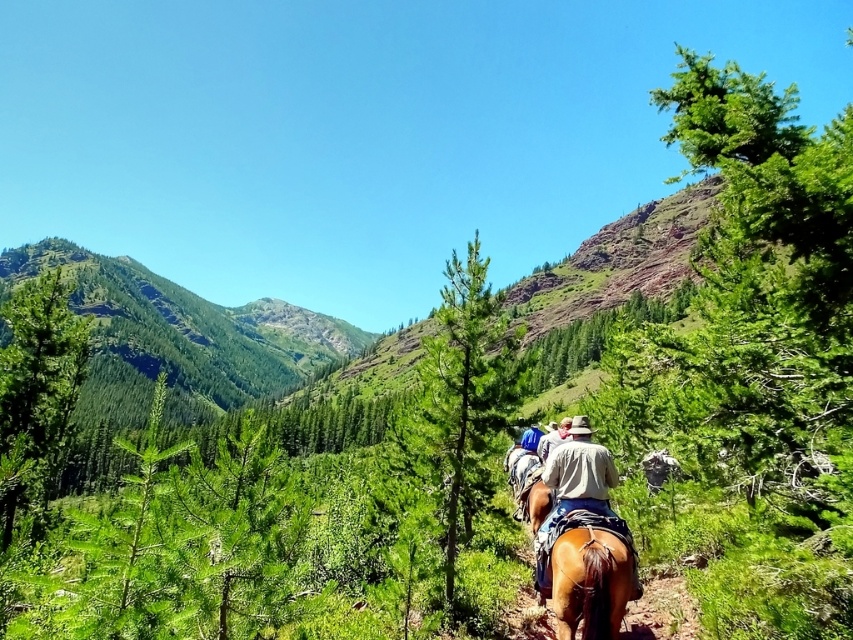
You are a photographer trying to capture a clear shot of the brown leather horse at center and the light brown leather jacket at center. Since you want the horse to be the main focus, which object should you position closer to the camera to ensure it appears larger in the photo?

The brown leather horse at center has a lesser height compared to the light brown leather jacket at center, so to make the horse appear larger in the photo, you should position the horse closer to the camera than the light brown leather jacket at center.

You are a photographer trying to capture a clear shot of the brown leather horse at center and the light brown leather jacket at center. Since you want both subjects to be in focus, which one should you focus on first, the wider object or the narrower one?

The brown leather horse at center has a lesser width compared to light brown leather jacket at center. Therefore, you should focus on the light brown leather jacket at center first since it is wider and will be easier to keep in focus.

You are a photographer trying to capture a photo of the brown leather horse at center and the light brown leather jacket at center. Which object should you focus on first if you want to include both in the frame without moving your camera?

You should focus on the brown leather horse at center first because it is positioned to the left of the light brown leather jacket at center, so adjusting the frame to include both would require ensuring the left side is captured first.